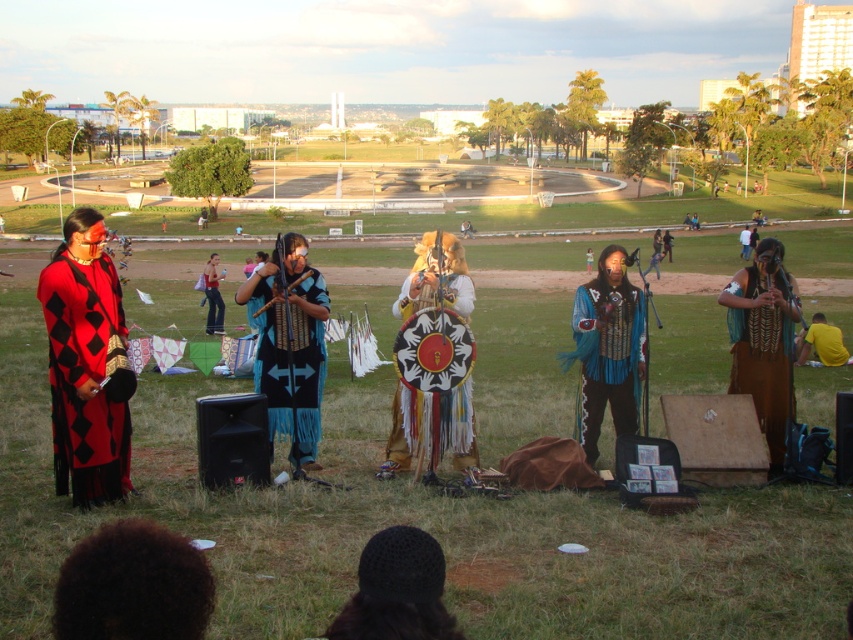
You are a photographer at the event and want to capture both the blue fringed vest at center and the blue fabric dress at center in the same frame. Which object should be placed to the left in your photo?

The blue fabric dress at center should be placed to the left in your photo since the blue fringed vest at center is positioned on the right side of it.

You are a photographer standing at the center of the scene. You notice a point at coordinates point (291, 356). Which object is this point located on?

The point (291, 356) is located on the blue fringed vest at center.

You are a photographer standing in front of the performers and want to take a photo. You notice two points in the scene labeled as point (x=299, y=456) and point (x=785, y=356). Which point should you focus on first if you want to capture the closest object in your frame?

Point (x=299, y=456) is closer to the camera than point (x=785, y=356), so you should focus on point (x=299, y=456) first to capture the closest object in your frame.